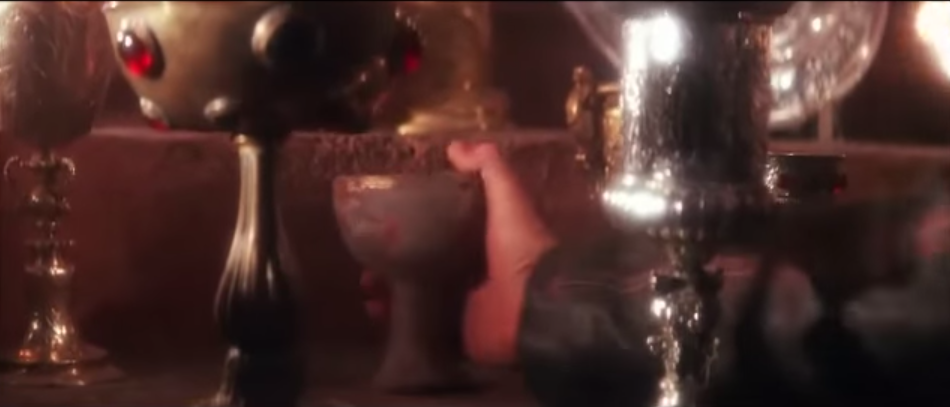
In order to click on simple goblet in this screenshot , I will do `click(418, 230)`.